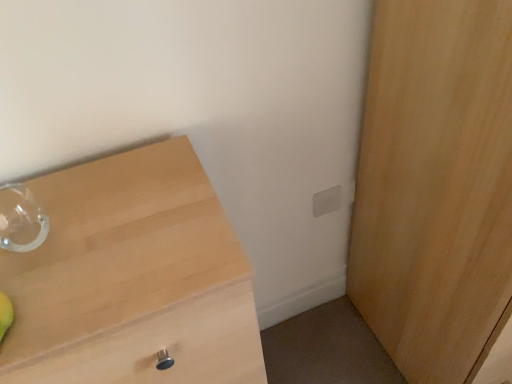
In order to face light wood cupboard at right, should I rotate leftwards or rightwards?

It's best to rotate right around 28.438 degrees.

What is the approximate width of white matte electric outlet at upper right?

The width of white matte electric outlet at upper right is 0.55 inches.

Describe the element at coordinates (326, 201) in the screenshot. This screenshot has height=384, width=512. I see `white matte electric outlet at upper right` at that location.

The width and height of the screenshot is (512, 384). What are the coordinates of `light wood cupboard at right` in the screenshot? It's located at (435, 185).

From a real-world perspective, is light wood chest of drawers at left located beneath white matte electric outlet at upper right?

Yes, from a real-world perspective, light wood chest of drawers at left is below white matte electric outlet at upper right.

Does light wood chest of drawers at left have a smaller size compared to white matte electric outlet at upper right?

No.

Is light wood chest of drawers at left positioned far away from white matte electric outlet at upper right?

Actually, light wood chest of drawers at left and white matte electric outlet at upper right are a little close together.

Considering the points (111, 275) and (335, 208), which point is in front, point (111, 275) or point (335, 208)?

Point (111, 275)

Which is correct: light wood chest of drawers at left is inside light wood cupboard at right, or outside of it?

light wood chest of drawers at left is not enclosed by light wood cupboard at right.

Which point is more distant from viewer, (210, 315) or (492, 0)?

The point (210, 315) is more distant.

From a real-world perspective, is light wood chest of drawers at left physically located above or below light wood cupboard at right?

light wood chest of drawers at left is below light wood cupboard at right.

Would you say light wood chest of drawers at left is part of white matte electric outlet at upper right's contents?

Actually, light wood chest of drawers at left is outside white matte electric outlet at upper right.

How different are the orientations of white matte electric outlet at upper right and light wood chest of drawers at left in degrees?

The facing directions of white matte electric outlet at upper right and light wood chest of drawers at left are 0.862 degrees apart.

Does white matte electric outlet at upper right have a lesser width compared to light wood chest of drawers at left?

Yes.

From the image's perspective, which one is positioned lower, white matte electric outlet at upper right or light wood chest of drawers at left?

light wood chest of drawers at left, from the image's perspective.

What's the angular difference between white matte electric outlet at upper right and light wood cupboard at right's facing directions?

They differ by 1.91 degrees in their facing directions.

Image resolution: width=512 pixels, height=384 pixels. What are the coordinates of `electric outlet that appears on the left of light wood cupboard at right` in the screenshot? It's located at (326, 201).

Is white matte electric outlet at upper right spatially inside light wood cupboard at right, or outside of it?

white matte electric outlet at upper right is outside light wood cupboard at right.

Considering the points (313, 201) and (503, 208), which point is behind, point (313, 201) or point (503, 208)?

The point (313, 201) is farther.

Which of these two, light wood cupboard at right or white matte electric outlet at upper right, is wider?

light wood cupboard at right is wider.

Is light wood cupboard at right beside white matte electric outlet at upper right?

There is a gap between light wood cupboard at right and white matte electric outlet at upper right.

From the image's perspective, who appears lower, light wood cupboard at right or white matte electric outlet at upper right?

light wood cupboard at right appears lower in the image.

From a real-world perspective, is light wood cupboard at right positioned above or below white matte electric outlet at upper right?

Clearly, from a real-world perspective, light wood cupboard at right is above white matte electric outlet at upper right.

Can you confirm if light wood cupboard at right is thinner than light wood chest of drawers at left?

No, light wood cupboard at right is not thinner than light wood chest of drawers at left.

How different are the orientations of light wood cupboard at right and light wood chest of drawers at left in degrees?

The angular difference between light wood cupboard at right and light wood chest of drawers at left is 1.04 degrees.

Could light wood chest of drawers at left be considered to be inside light wood cupboard at right?

No.

The height and width of the screenshot is (384, 512). I want to click on electric outlet that appears behind the light wood chest of drawers at left, so click(326, 201).

At what (x,y) coordinates should I click in order to perform the action: click on cupboard above the light wood chest of drawers at left (from a real-world perspective). Please return your answer as a coordinate pair (x, y). Looking at the image, I should click on (435, 185).

Based on their spatial positions, is light wood cupboard at right or light wood chest of drawers at left further from white matte electric outlet at upper right?

Based on the image, light wood chest of drawers at left appears to be further to white matte electric outlet at upper right.

Estimate the real-world distances between objects in this image. Which object is further from light wood cupboard at right, white matte electric outlet at upper right or light wood chest of drawers at left?

Based on the image, light wood chest of drawers at left appears to be further to light wood cupboard at right.

Considering their positions, is white matte electric outlet at upper right positioned further to light wood chest of drawers at left than light wood cupboard at right?

white matte electric outlet at upper right.

Looking at the image, which one is located further to white matte electric outlet at upper right, light wood chest of drawers at left or light wood cupboard at right?

Among the two, light wood chest of drawers at left is located further to white matte electric outlet at upper right.

Considering their positions, is light wood chest of drawers at left positioned further to light wood cupboard at right than white matte electric outlet at upper right?

light wood chest of drawers at left.

Looking at the image, which one is located further to light wood chest of drawers at left, light wood cupboard at right or white matte electric outlet at upper right?

Based on the image, white matte electric outlet at upper right appears to be further to light wood chest of drawers at left.

At what (x,y) coordinates should I click in order to perform the action: click on electric outlet located between light wood chest of drawers at left and light wood cupboard at right in the left-right direction. Please return your answer as a coordinate pair (x, y). Looking at the image, I should click on (326, 201).